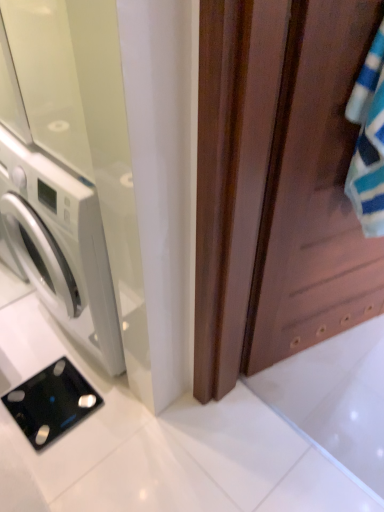
Question: From a real-world perspective, does white glossy door at left, the 2th screen door in the right-to-left sequence, sit lower than brown wooden screen door at right, placed as the 2th screen door when sorted from left to right?

Choices:
 (A) no
 (B) yes

Answer: (B)

Question: Can you confirm if white glossy door at left, arranged as the 1th screen door when viewed from the left, is positioned to the right of brown wooden screen door at right, the first screen door in the right-to-left sequence?

Choices:
 (A) yes
 (B) no

Answer: (B)

Question: Is white glossy door at left, the 2th screen door in the right-to-left sequence, touching brown wooden screen door at right, placed as the 2th screen door when sorted from left to right?

Choices:
 (A) yes
 (B) no

Answer: (B)

Question: Is white glossy door at left, arranged as the 1th screen door when viewed from the left, facing towards brown wooden screen door at right, the first screen door in the right-to-left sequence?

Choices:
 (A) no
 (B) yes

Answer: (A)

Question: Is there a large distance between white glossy door at left, the 2th screen door in the right-to-left sequence, and brown wooden screen door at right, the first screen door in the right-to-left sequence?

Choices:
 (A) yes
 (B) no

Answer: (B)

Question: From a real-world perspective, is white glossy door at left, the 2th screen door in the right-to-left sequence, over brown wooden screen door at right, the first screen door in the right-to-left sequence?

Choices:
 (A) yes
 (B) no

Answer: (B)

Question: Is black glass scale at lower left shorter than white glossy door at left, the 2th screen door in the right-to-left sequence?

Choices:
 (A) no
 (B) yes

Answer: (B)

Question: Can you confirm if black glass scale at lower left is taller than white glossy door at left, arranged as the 1th screen door when viewed from the left?

Choices:
 (A) yes
 (B) no

Answer: (B)

Question: Is black glass scale at lower left placed right next to white glossy door at left, arranged as the 1th screen door when viewed from the left?

Choices:
 (A) no
 (B) yes

Answer: (A)

Question: Is black glass scale at lower left not inside white glossy door at left, the 2th screen door in the right-to-left sequence?

Choices:
 (A) yes
 (B) no

Answer: (A)

Question: Is black glass scale at lower left turned away from white glossy door at left, the 2th screen door in the right-to-left sequence?

Choices:
 (A) no
 (B) yes

Answer: (B)

Question: Would you say black glass scale at lower left is a long distance from white glossy door at left, the 2th screen door in the right-to-left sequence?

Choices:
 (A) no
 (B) yes

Answer: (A)

Question: Is white glossy door at left, arranged as the 1th screen door when viewed from the left, not within black glass scale at lower left?

Choices:
 (A) no
 (B) yes

Answer: (B)